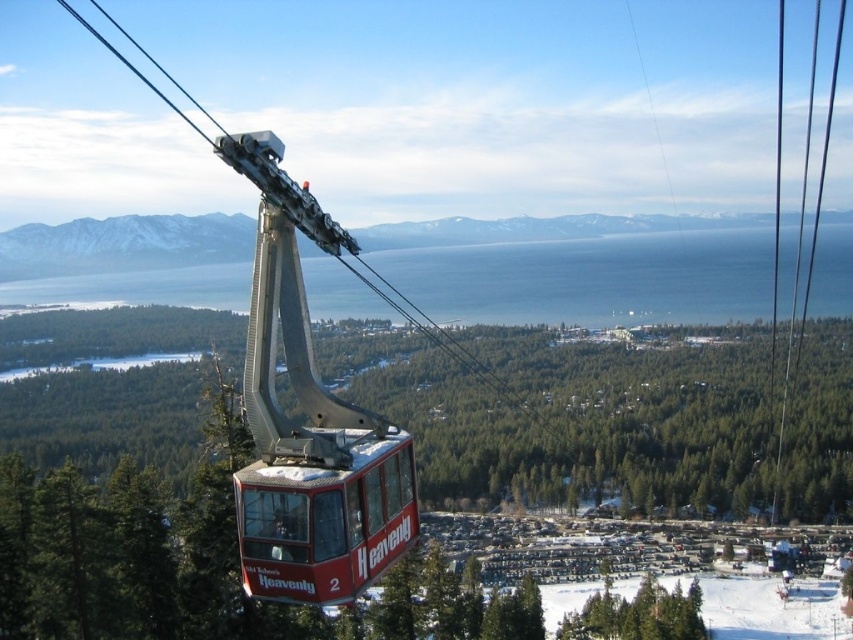
You are a passenger in the red glossy cable car at center. You look down and see the white snow at lower center. Can you determine if the cable car is higher than the snow below?

The red glossy cable car at center has a greater height compared to white snow at lower center, so yes, the cable car is higher than the snow below.

You are a passenger in the red glossy cable car at center. Looking down, you notice the white snow at lower center. Which area do you think covers a larger area from your viewpoint?

The white snow at lower center covers a larger area from your viewpoint because the red glossy cable car at center occupies less space than the white snow at lower center.